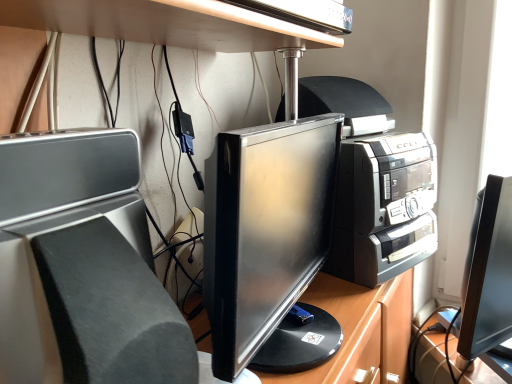
Question: Is metallic silver desk at upper center to the left or to the right of satin silver speaker at left in the image?

Choices:
 (A) left
 (B) right

Answer: (B)

Question: Considering the positions of metallic silver desk at upper center and satin silver speaker at left in the image, is metallic silver desk at upper center taller or shorter than satin silver speaker at left?

Choices:
 (A) short
 (B) tall

Answer: (A)

Question: Is metallic silver desk at upper center situated inside satin silver speaker at left or outside?

Choices:
 (A) inside
 (B) outside

Answer: (B)

Question: Visually, is satin silver speaker at left positioned to the left or to the right of metallic silver desk at upper center?

Choices:
 (A) left
 (B) right

Answer: (A)

Question: Does point (14, 153) appear closer or farther from the camera than point (11, 9)?

Choices:
 (A) closer
 (B) farther

Answer: (A)

Question: Is satin silver speaker at left in front of or behind metallic silver desk at upper center in the image?

Choices:
 (A) behind
 (B) front

Answer: (B)

Question: In terms of size, does satin silver speaker at left appear bigger or smaller than metallic silver desk at upper center?

Choices:
 (A) small
 (B) big

Answer: (B)